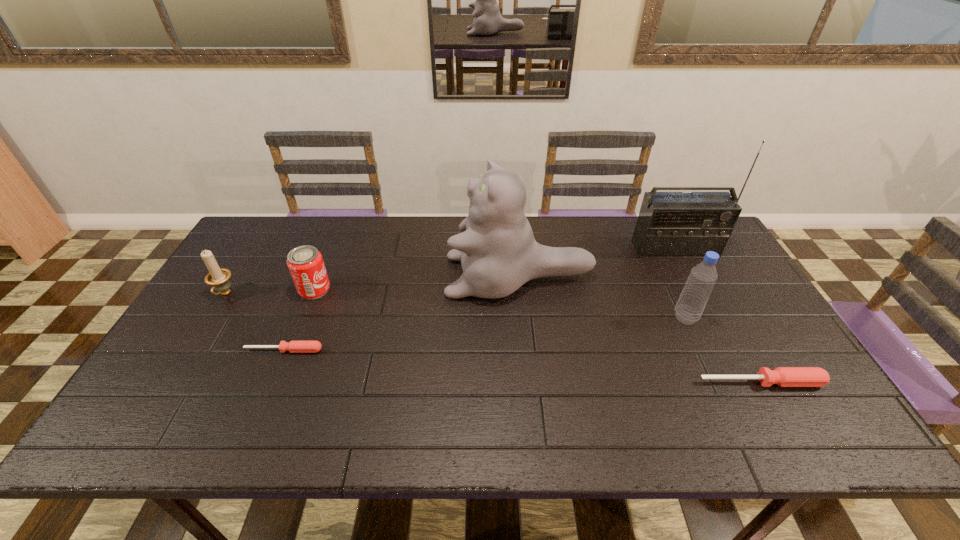
Where is `vacant space at the near right corner of the desktop`? vacant space at the near right corner of the desktop is located at coordinates (810, 388).

This screenshot has width=960, height=540. I want to click on empty space between the fifth shortest object and the left screwdriver, so click(485, 334).

The height and width of the screenshot is (540, 960). I want to click on vacant point located between the third tallest object and the radio receiver, so click(681, 284).

At what (x,y) coordinates should I click in order to perform the action: click on vacant space that is in between the radio receiver and the leftmost object. Please return your answer as a coordinate pair (x, y). Looking at the image, I should click on (450, 272).

Find the location of a particular element. vacant area that lies between the third shortest object and the cat is located at coordinates (417, 283).

Image resolution: width=960 pixels, height=540 pixels. I want to click on free space between the leftmost object and the cat, so click(372, 285).

Locate an element on the screen. The height and width of the screenshot is (540, 960). vacant area that lies between the radio receiver and the candle_holder is located at coordinates (450, 272).

The height and width of the screenshot is (540, 960). I want to click on free space between the shorter screwdriver and the nearest object, so click(x=522, y=366).

At what (x,y) coordinates should I click in order to perform the action: click on free space that is in between the fourth object from right to left and the fifth farthest object. Please return your answer as a coordinate pair (x, y). The width and height of the screenshot is (960, 540). Looking at the image, I should click on (602, 297).

You are a GUI agent. You are given a task and a screenshot of the screen. Output one action in this format:
    pyautogui.click(x=<x>, y=<y>)
    Task: Click on the empty space that is in between the sixth tallest object and the candle_holder
    
    Given the screenshot: What is the action you would take?
    pyautogui.click(x=492, y=338)